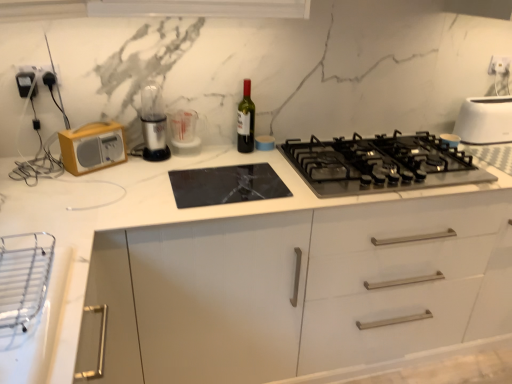
Question: Is black matte gas stove at center oriented away from clear plastic measuring cup at center, arranged as the first appliance when ordered from the bottom?

Choices:
 (A) yes
 (B) no

Answer: (B)

Question: Can we say black matte gas stove at center lies outside clear plastic measuring cup at center, the second appliance in the front-to-back sequence?

Choices:
 (A) yes
 (B) no

Answer: (A)

Question: Is black matte gas stove at center smaller than clear plastic measuring cup at center, arranged as the first appliance when ordered from the bottom?

Choices:
 (A) no
 (B) yes

Answer: (A)

Question: Does black matte gas stove at center have a greater height compared to clear plastic measuring cup at center, arranged as the first appliance when ordered from the bottom?

Choices:
 (A) no
 (B) yes

Answer: (A)

Question: Is black matte gas stove at center further to camera compared to clear plastic measuring cup at center, the second appliance in the front-to-back sequence?

Choices:
 (A) yes
 (B) no

Answer: (B)

Question: Does black matte gas stove at center have a lesser width compared to clear plastic measuring cup at center, which is the first appliance from right to left?

Choices:
 (A) yes
 (B) no

Answer: (B)

Question: Does black matte gas stove at center turn towards wooden radio at left?

Choices:
 (A) yes
 (B) no

Answer: (B)

Question: Is black matte gas stove at center looking in the opposite direction of wooden radio at left?

Choices:
 (A) yes
 (B) no

Answer: (B)

Question: Is black matte gas stove at center to the left of wooden radio at left from the viewer's perspective?

Choices:
 (A) no
 (B) yes

Answer: (A)

Question: From a real-world perspective, is black matte gas stove at center on top of wooden radio at left?

Choices:
 (A) yes
 (B) no

Answer: (B)

Question: Can you confirm if black matte gas stove at center is taller than wooden radio at left?

Choices:
 (A) no
 (B) yes

Answer: (A)

Question: From the image's perspective, is black matte gas stove at center over wooden radio at left?

Choices:
 (A) no
 (B) yes

Answer: (A)

Question: From the image's perspective, does white plastic toaster at upper right appear higher than clear plastic measuring cup at center, the second appliance in the front-to-back sequence?

Choices:
 (A) no
 (B) yes

Answer: (B)